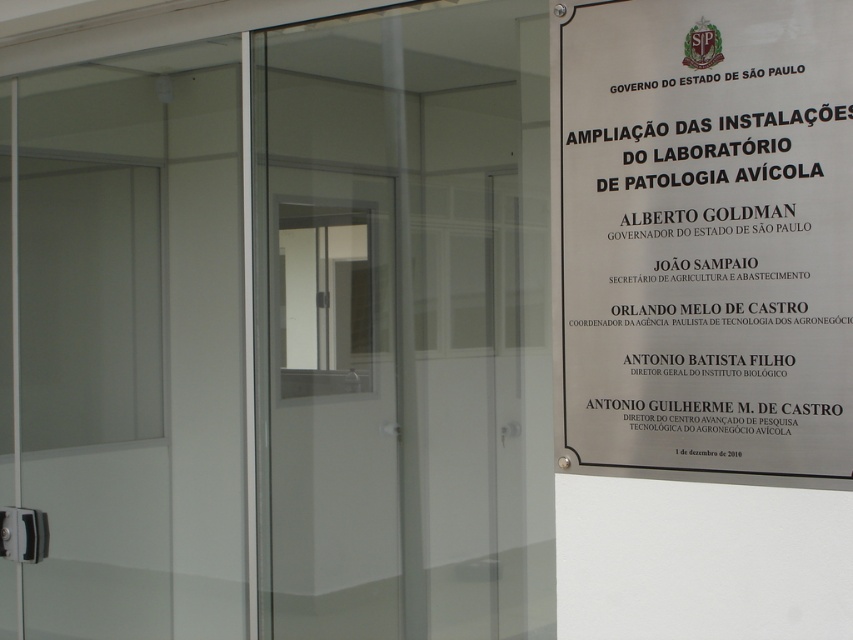
What do you see at coordinates (283, 332) in the screenshot? Image resolution: width=853 pixels, height=640 pixels. I see `transparent glass door at center` at bounding box center [283, 332].

Which is more to the right, transparent glass door at center or metallic plaque at right?

From the viewer's perspective, metallic plaque at right appears more on the right side.

Between point (49, 204) and point (614, 68), which one is positioned in front?

Point (614, 68) is more forward.

You are a GUI agent. You are given a task and a screenshot of the screen. Output one action in this format:
    pyautogui.click(x=<x>, y=<y>)
    Task: Click on the transparent glass door at center
    The image size is (853, 640).
    Given the screenshot: What is the action you would take?
    pyautogui.click(x=283, y=332)

Which of these two, metallic plaque at right or transparent glass screen door at center, stands shorter?

Standing shorter between the two is metallic plaque at right.

Is point (717, 112) closer to viewer compared to point (415, 557)?

Yes, it is.

Identify the location of metallic plaque at right. (703, 240).

I want to click on metallic plaque at right, so click(703, 240).

Between transparent glass door at center and transparent glass screen door at center, which one is positioned higher?

transparent glass door at center

Which of these two, transparent glass door at center or transparent glass screen door at center, stands shorter?

transparent glass screen door at center is shorter.

Between point (280, 193) and point (384, 291), which one is positioned behind?

The point (384, 291) is behind.

Where is `transparent glass door at center`? The height and width of the screenshot is (640, 853). transparent glass door at center is located at coordinates (283, 332).